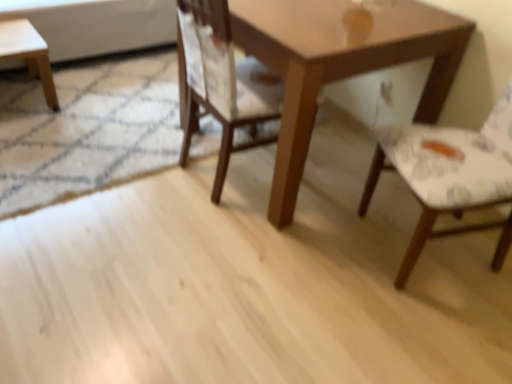
Question: Considering the relative sizes of light brown wooden stool at left and wooden chair at center, acting as the second chair starting from the right, in the image provided, is light brown wooden stool at left wider than wooden chair at center, acting as the second chair starting from the right,?

Choices:
 (A) yes
 (B) no

Answer: (B)

Question: Considering the relative positions of light brown wooden stool at left and wooden chair at center, the 1th chair in the left-to-right sequence, in the image provided, is light brown wooden stool at left to the left of wooden chair at center, the 1th chair in the left-to-right sequence, from the viewer's perspective?

Choices:
 (A) yes
 (B) no

Answer: (A)

Question: Is light brown wooden stool at left taller than wooden chair at center, the 1th chair in the left-to-right sequence?

Choices:
 (A) yes
 (B) no

Answer: (B)

Question: Is light brown wooden stool at left aimed at wooden chair at center, the 1th chair in the left-to-right sequence?

Choices:
 (A) no
 (B) yes

Answer: (A)

Question: Considering the relative positions of light brown wooden stool at left and wooden chair at center, the 1th chair in the left-to-right sequence, in the image provided, is light brown wooden stool at left in front of wooden chair at center, the 1th chair in the left-to-right sequence,?

Choices:
 (A) no
 (B) yes

Answer: (A)

Question: Would you say light brown wooden stool at left is outside wooden chair at center, acting as the second chair starting from the right?

Choices:
 (A) yes
 (B) no

Answer: (A)

Question: Considering the relative positions of wooden table at center and wooden chair at center, acting as the second chair starting from the right, in the image provided, is wooden table at center to the right of wooden chair at center, acting as the second chair starting from the right, from the viewer's perspective?

Choices:
 (A) no
 (B) yes

Answer: (B)

Question: Does wooden table at center turn towards wooden chair at center, the 1th chair in the left-to-right sequence?

Choices:
 (A) no
 (B) yes

Answer: (B)

Question: Considering the relative sizes of wooden table at center and wooden chair at center, acting as the second chair starting from the right, in the image provided, is wooden table at center bigger than wooden chair at center, acting as the second chair starting from the right,?

Choices:
 (A) no
 (B) yes

Answer: (B)

Question: Can you see wooden table at center touching wooden chair at center, acting as the second chair starting from the right?

Choices:
 (A) yes
 (B) no

Answer: (B)

Question: From a real-world perspective, is wooden table at center located beneath wooden chair at center, acting as the second chair starting from the right?

Choices:
 (A) yes
 (B) no

Answer: (A)

Question: From a real-world perspective, is wooden table at center positioned over wooden chair at center, acting as the second chair starting from the right, based on gravity?

Choices:
 (A) no
 (B) yes

Answer: (A)

Question: Is light brown wooden stool at left smaller than white fabric chair at right, which appears as the first chair when viewed from the right?

Choices:
 (A) yes
 (B) no

Answer: (A)